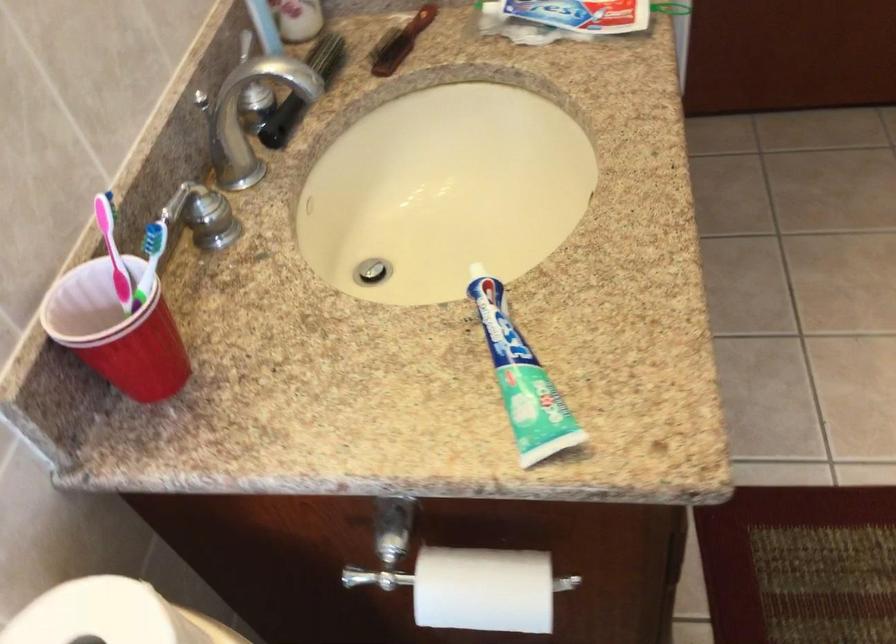
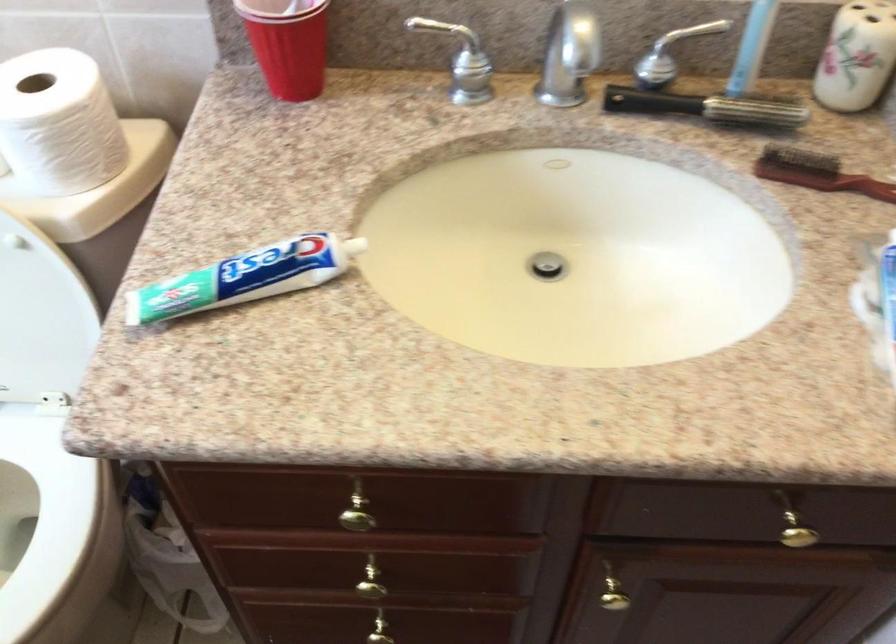
Locate, in the second image, the point that corresponds to (x=308, y=80) in the first image.

(707, 107)